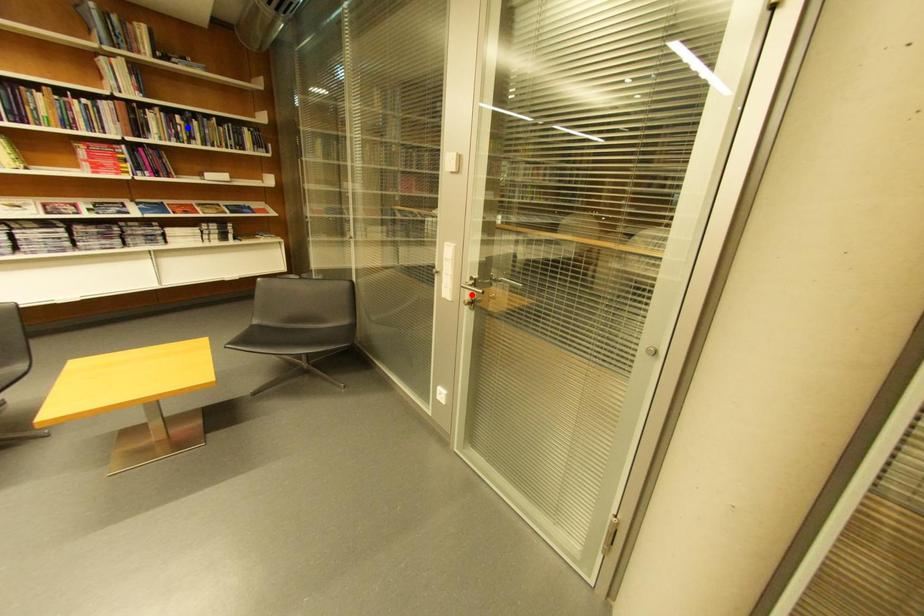
Question: Two points are marked on the image. Which point is closer to the camera?

Choices:
 (A) Blue point is closer.
 (B) Red point is closer.

Answer: (B)